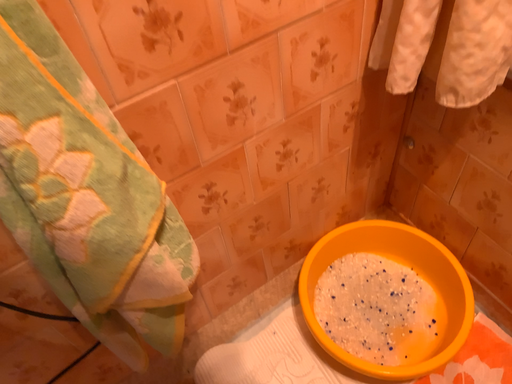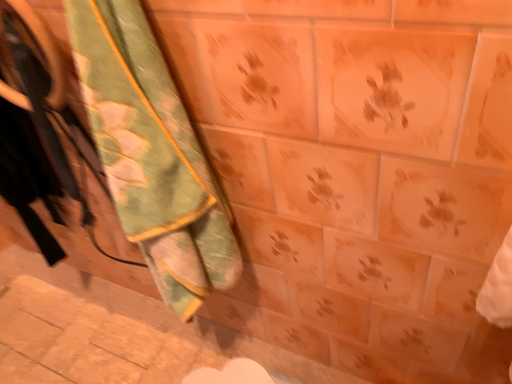
Question: Which way did the camera rotate in the video?

Choices:
 (A) rotated downward
 (B) rotated upward

Answer: (B)